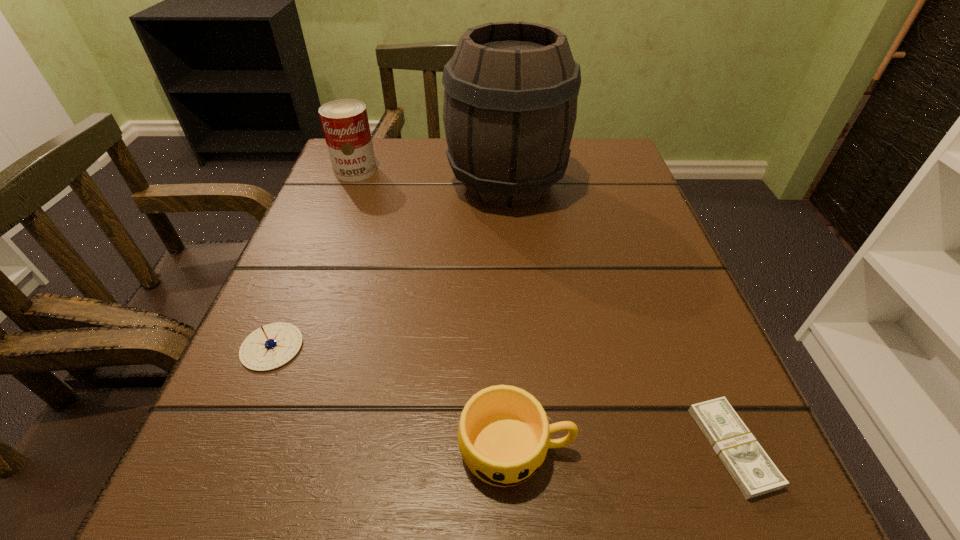
Locate an element on the screen. The image size is (960, 540). the tallest object is located at coordinates (510, 101).

Locate an element on the screen. The width and height of the screenshot is (960, 540). can is located at coordinates (345, 124).

You are a GUI agent. You are given a task and a screenshot of the screen. Output one action in this format:
    pyautogui.click(x=<x>, y=<y>)
    Task: Click on the third tallest object
    The width and height of the screenshot is (960, 540).
    Given the screenshot: What is the action you would take?
    pyautogui.click(x=503, y=435)

The height and width of the screenshot is (540, 960). Find the location of `compass`. compass is located at coordinates (271, 346).

At what (x,y) coordinates should I click in order to perform the action: click on the third farthest object. Please return your answer as a coordinate pair (x, y). This screenshot has width=960, height=540. Looking at the image, I should click on (271, 346).

Image resolution: width=960 pixels, height=540 pixels. I want to click on the rightmost object, so click(x=749, y=465).

Where is `the shortest object`? Image resolution: width=960 pixels, height=540 pixels. the shortest object is located at coordinates (749, 465).

Locate an element on the screen. The height and width of the screenshot is (540, 960). free location located 0.070m on the right of the wine bucket is located at coordinates (x=600, y=184).

This screenshot has height=540, width=960. I want to click on free point located 0.350m on the front label of the second tallest object, so click(x=304, y=303).

Locate an element on the screen. free space located on the back of the third shortest object is located at coordinates (504, 257).